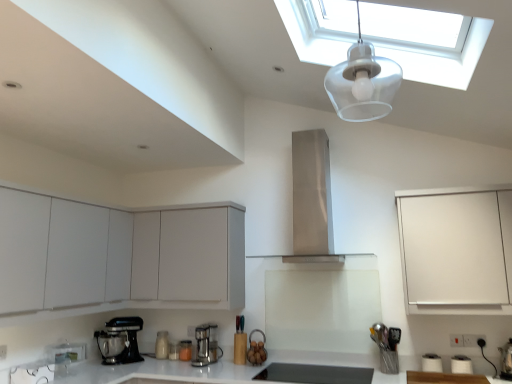
Where is `matte white blender at center, acting as the 2th kitchen appliance starting from the left`? This screenshot has width=512, height=384. matte white blender at center, acting as the 2th kitchen appliance starting from the left is located at coordinates (162, 345).

Image resolution: width=512 pixels, height=384 pixels. Describe the element at coordinates (315, 374) in the screenshot. I see `shiny black stove at lower center` at that location.

I want to click on white matte cabinet at lower left, which is the third cabinetry from right to left, so click(117, 256).

The width and height of the screenshot is (512, 384). What do you see at coordinates (426, 42) in the screenshot? I see `transparent glass skylight at upper center` at bounding box center [426, 42].

At what (x,y) coordinates should I click in order to perform the action: click on matte white blender at center, the third kitchen appliance from the right. Please return your answer as a coordinate pair (x, y). The height and width of the screenshot is (384, 512). Looking at the image, I should click on tap(162, 345).

Do you think metallic silver coffee maker at center, the second kitchen appliance positioned from the right, is within stainless steel range hood at center, or outside of it?

metallic silver coffee maker at center, the second kitchen appliance positioned from the right, is not enclosed by stainless steel range hood at center.

Between point (183, 357) and point (305, 261), which one is positioned in front?

The point (183, 357) is closer to the camera.

From the image's perspective, between metallic silver coffee maker at center, marked as the third kitchen appliance in a left-to-right arrangement, and stainless steel range hood at center, which one is located above?

stainless steel range hood at center is shown above in the image.

Does white matte cabinet at right, which is counted as the third cabinetry, starting from the left, have a lesser width compared to white matte cabinet at lower left, which is the third cabinetry from right to left?

Correct, the width of white matte cabinet at right, which is counted as the third cabinetry, starting from the left, is less than that of white matte cabinet at lower left, which is the third cabinetry from right to left.

From a real-world perspective, between white matte cabinet at right, which is counted as the third cabinetry, starting from the left, and white matte cabinet at lower left, which is counted as the 1th cabinetry, starting from the left, who is vertically higher?

In real-world perspective, white matte cabinet at lower left, which is counted as the 1th cabinetry, starting from the left, is above.

From the image's perspective, which one is positioned lower, white matte cabinet at right, arranged as the 1th cabinetry when viewed from the right, or white matte cabinet at lower left, which is the third cabinetry from right to left?

white matte cabinet at right, arranged as the 1th cabinetry when viewed from the right, appears lower in the image.

Does point (404, 245) lie in front of point (36, 253)?

No, it is not.

In terms of size, does matte black mixer at lower left, which is counted as the 1th kitchen appliance, starting from the left, appear bigger or smaller than shiny black stove at lower center?

matte black mixer at lower left, which is counted as the 1th kitchen appliance, starting from the left, is bigger than shiny black stove at lower center.

From the picture: Is shiny black stove at lower center a part of matte black mixer at lower left, which is counted as the 1th kitchen appliance, starting from the left?

No, shiny black stove at lower center is located outside of matte black mixer at lower left, which is counted as the 1th kitchen appliance, starting from the left.

Considering the sizes of objects matte black mixer at lower left, which appears as the 4th kitchen appliance when viewed from the right, and shiny black stove at lower center in the image provided, who is wider, matte black mixer at lower left, which appears as the 4th kitchen appliance when viewed from the right, or shiny black stove at lower center?

With larger width is shiny black stove at lower center.

Locate an element on the screen. This screenshot has height=384, width=512. appliance beneath the matte black mixer at lower left, which appears as the 4th kitchen appliance when viewed from the right (from a real-world perspective) is located at coordinates (315, 374).

From the picture: Considering the relative sizes of white matte cabinet at right, which is counted as the third cabinetry, starting from the left, and metallic silver coffee maker at center, the second kitchen appliance positioned from the right, in the image provided, is white matte cabinet at right, which is counted as the third cabinetry, starting from the left, thinner than metallic silver coffee maker at center, the second kitchen appliance positioned from the right,?

In fact, white matte cabinet at right, which is counted as the third cabinetry, starting from the left, might be wider than metallic silver coffee maker at center, the second kitchen appliance positioned from the right.

Is white matte cabinet at right, which is counted as the third cabinetry, starting from the left, outside of metallic silver coffee maker at center, the second kitchen appliance positioned from the right?

Absolutely, white matte cabinet at right, which is counted as the third cabinetry, starting from the left, is external to metallic silver coffee maker at center, the second kitchen appliance positioned from the right.

Is point (458, 198) closer to camera compared to point (188, 349)?

Yes, point (458, 198) is closer to viewer.

From the image's perspective, which one is positioned higher, white matte cabinet at right, arranged as the 1th cabinetry when viewed from the right, or metallic silver coffee maker at center, marked as the third kitchen appliance in a left-to-right arrangement?

From the image's view, white matte cabinet at right, arranged as the 1th cabinetry when viewed from the right, is above.

Can you confirm if transparent glass skylight at upper center is smaller than matte black mixer at lower left, which is counted as the 1th kitchen appliance, starting from the left?

Incorrect, transparent glass skylight at upper center is not smaller in size than matte black mixer at lower left, which is counted as the 1th kitchen appliance, starting from the left.

Is the position of transparent glass skylight at upper center more distant than that of matte black mixer at lower left, which appears as the 4th kitchen appliance when viewed from the right?

No.

Considering the positions of objects transparent glass skylight at upper center and matte black mixer at lower left, which is counted as the 1th kitchen appliance, starting from the left, in the image provided, who is more to the right, transparent glass skylight at upper center or matte black mixer at lower left, which is counted as the 1th kitchen appliance, starting from the left,?

Positioned to the right is transparent glass skylight at upper center.

In the scene shown: Is transparent glass skylight at upper center oriented towards matte black mixer at lower left, which is counted as the 1th kitchen appliance, starting from the left?

No.

From a real-world perspective, is transparent plastic light fixture at upper center physically located above or below shiny black stove at lower center?

From a real-world perspective, transparent plastic light fixture at upper center is physically above shiny black stove at lower center.

Is transparent plastic light fixture at upper center situated inside shiny black stove at lower center or outside?

transparent plastic light fixture at upper center lies outside shiny black stove at lower center.

From the image's perspective, which is above, transparent plastic light fixture at upper center or shiny black stove at lower center?

transparent plastic light fixture at upper center, from the image's perspective.

Can you confirm if white matte cabinet at center, the second cabinetry from the left, is shorter than metallic silver coffee maker at center, marked as the third kitchen appliance in a left-to-right arrangement?

No, white matte cabinet at center, the second cabinetry from the left, is not shorter than metallic silver coffee maker at center, marked as the third kitchen appliance in a left-to-right arrangement.

In the scene shown: Which object is positioned more to the right, white matte cabinet at center, positioned as the 2th cabinetry in right-to-left order, or metallic silver coffee maker at center, the second kitchen appliance positioned from the right?

white matte cabinet at center, positioned as the 2th cabinetry in right-to-left order.

From a real-world perspective, is white matte cabinet at center, positioned as the 2th cabinetry in right-to-left order, above or below metallic silver coffee maker at center, marked as the third kitchen appliance in a left-to-right arrangement?

Clearly, from a real-world perspective, white matte cabinet at center, positioned as the 2th cabinetry in right-to-left order, is above metallic silver coffee maker at center, marked as the third kitchen appliance in a left-to-right arrangement.

Considering the relative sizes of white matte cabinet at center, the second cabinetry from the left, and metallic silver coffee maker at center, marked as the third kitchen appliance in a left-to-right arrangement, in the image provided, is white matte cabinet at center, the second cabinetry from the left, bigger than metallic silver coffee maker at center, marked as the third kitchen appliance in a left-to-right arrangement,?

Correct, white matte cabinet at center, the second cabinetry from the left, is larger in size than metallic silver coffee maker at center, marked as the third kitchen appliance in a left-to-right arrangement.

Where is `home appliance above the metallic silver coffee maker at center, the second kitchen appliance positioned from the right (from the image's perspective)`? The height and width of the screenshot is (384, 512). home appliance above the metallic silver coffee maker at center, the second kitchen appliance positioned from the right (from the image's perspective) is located at coordinates (312, 199).

Locate an element on the screen. This screenshot has width=512, height=384. cabinetry directly beneath the white matte cabinet at lower left, which is the third cabinetry from right to left (from a real-world perspective) is located at coordinates (456, 251).

Based on their spatial positions, is transparent plastic light fixture at upper center or satin chrome coffee maker at center, the first kitchen appliance viewed from the right, further from white matte cabinet at center, positioned as the 2th cabinetry in right-to-left order?

transparent plastic light fixture at upper center is further to white matte cabinet at center, positioned as the 2th cabinetry in right-to-left order.

Based on their spatial positions, is transparent glass skylight at upper center or stainless steel range hood at center closer to white matte cabinet at right, arranged as the 1th cabinetry when viewed from the right?

stainless steel range hood at center is positioned closer to the anchor white matte cabinet at right, arranged as the 1th cabinetry when viewed from the right.

Considering their positions, is white matte cabinet at center, the second cabinetry from the left, positioned further to matte black mixer at lower left, which is counted as the 1th kitchen appliance, starting from the left, than white matte cabinet at lower left, which is the third cabinetry from right to left?

white matte cabinet at lower left, which is the third cabinetry from right to left, lies further to matte black mixer at lower left, which is counted as the 1th kitchen appliance, starting from the left, than the other object.

Based on their spatial positions, is transparent plastic light fixture at upper center or white matte cabinet at center, positioned as the 2th cabinetry in right-to-left order, closer to matte white blender at center, acting as the 2th kitchen appliance starting from the left?

white matte cabinet at center, positioned as the 2th cabinetry in right-to-left order, lies closer to matte white blender at center, acting as the 2th kitchen appliance starting from the left, than the other object.

When comparing their distances from white glossy countertop at lower center, does metallic silver coffee maker at center, the second kitchen appliance positioned from the right, or transparent plastic light fixture at upper center seem further?

transparent plastic light fixture at upper center is positioned further to the anchor white glossy countertop at lower center.

When comparing their distances from white glossy countertop at lower center, does transparent glass skylight at upper center or stainless steel range hood at center seem closer?

stainless steel range hood at center.

Based on their spatial positions, is matte black mixer at lower left, which appears as the 4th kitchen appliance when viewed from the right, or white matte cabinet at right, arranged as the 1th cabinetry when viewed from the right, closer to matte white blender at center, the third kitchen appliance from the right?

The object closer to matte white blender at center, the third kitchen appliance from the right, is matte black mixer at lower left, which appears as the 4th kitchen appliance when viewed from the right.

Looking at the image, which one is located closer to transparent plastic light fixture at upper center, white matte cabinet at center, positioned as the 2th cabinetry in right-to-left order, or metallic silver coffee maker at center, the second kitchen appliance positioned from the right?

The object closer to transparent plastic light fixture at upper center is white matte cabinet at center, positioned as the 2th cabinetry in right-to-left order.

At what (x,y) coordinates should I click in order to perform the action: click on home appliance between transparent glass skylight at upper center and shiny black stove at lower center in the vertical direction. Please return your answer as a coordinate pair (x, y). The width and height of the screenshot is (512, 384). Looking at the image, I should click on (312, 199).

You are a GUI agent. You are given a task and a screenshot of the screen. Output one action in this format:
    pyautogui.click(x=<x>, y=<y>)
    Task: Click on the appliance between metallic silver coffee maker at center, marked as the third kitchen appliance in a left-to-right arrangement, and white matte cabinet at right, arranged as the 1th cabinetry when viewed from the right, from left to right
    
    Given the screenshot: What is the action you would take?
    pyautogui.click(x=315, y=374)

Locate an element on the screen. appliance between transparent plastic light fixture at upper center and matte white blender at center, acting as the 2th kitchen appliance starting from the left, from front to back is located at coordinates 315,374.

Locate an element on the screen. The width and height of the screenshot is (512, 384). home appliance located between white matte cabinet at lower left, which is the third cabinetry from right to left, and metallic silver coffee maker at center, the second kitchen appliance positioned from the right, in the depth direction is located at coordinates (312, 199).